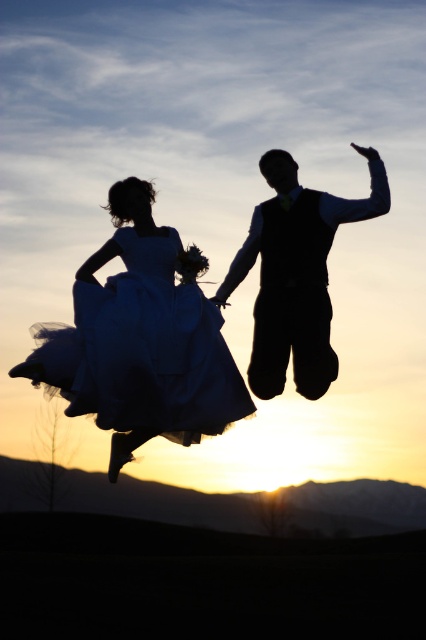
Question: Estimate the real-world distances between objects in this image. Which object is closer to the white tulle dress at center?

Choices:
 (A) blue tulle dress at center
 (B) silhouette vest at center

Answer: (A)

Question: Can you confirm if white tulle dress at center is smaller than silhouette vest at center?

Choices:
 (A) no
 (B) yes

Answer: (A)

Question: Does blue tulle dress at center come behind silhouette vest at center?

Choices:
 (A) no
 (B) yes

Answer: (A)

Question: Can you confirm if white tulle dress at center is wider than silhouette vest at center?

Choices:
 (A) yes
 (B) no

Answer: (A)

Question: Which of the following is the farthest from the observer?

Choices:
 (A) (187, 410)
 (B) (218, 288)
 (C) (89, 406)

Answer: (B)

Question: Which point is closer to the camera taking this photo?

Choices:
 (A) (129, 417)
 (B) (198, 344)
 (C) (285, 301)

Answer: (A)